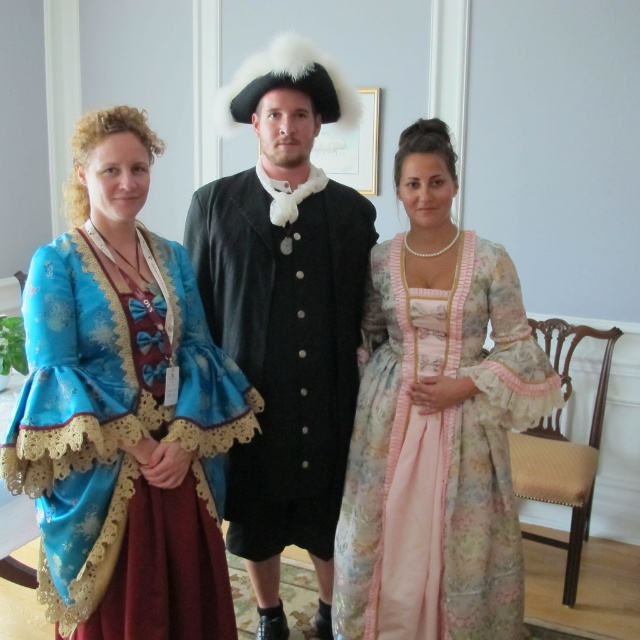
You are a photographer setting up a shoot in this historical scene. You need to position a light source to the right of both the matte blue fabric dress at left and the floral silk dress at center. Is this possible given their positions?

The matte blue fabric dress at left is to the left of the floral silk dress at center. Since the floral silk dress at center is already to the right of the matte blue fabric dress at left, placing a light source to the right of both would require positioning it further to the right of the floral silk dress at center.

You are a costume designer preparing for a play. You have two costumes to display side by side on a stage. The first is the matte blue fabric dress at left and the second is the black satin coat at center. Based on their sizes, which costume should you place closer to the audience to ensure both are visible?

The matte blue fabric dress at left occupies less space than the black satin coat at center, so you should place the black satin coat at center closer to the audience to ensure both are visible.

You are an art conservator examining this historical painting. You need to clean two specific points on the canvas. The first point is at coordinate point (104, 179) and the second is at point (387, 369). Which point will require you to lean closer to the canvas to reach it?

Point (104, 179) is closer to the viewer than point (387, 369), so you will need to lean closer to the canvas to clean point (104, 179).